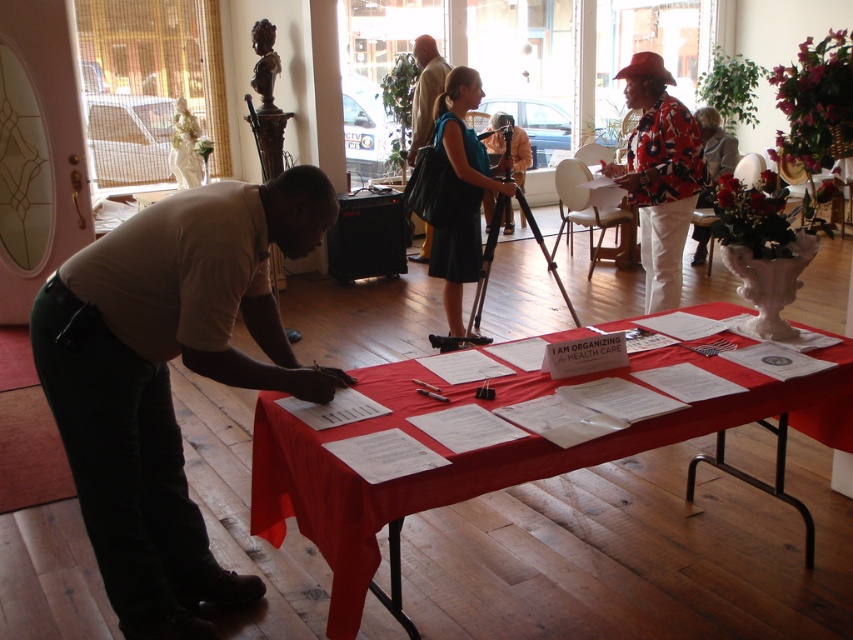
You are standing at the entrance of the room and see two points marked on the floor. The first point is at coordinate point(x=257, y=403) and the second is at point(x=498, y=168). Which point is closer to you?

Point(x=257, y=403) is in front of point(x=498, y=168), so it is closer to you.